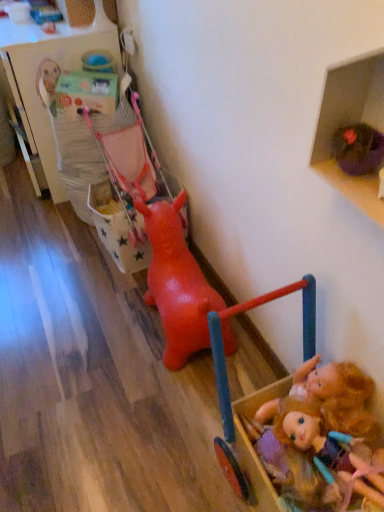
Where is `wooden toy box at upper left, the second shelf in the right-to-left sequence`? wooden toy box at upper left, the second shelf in the right-to-left sequence is located at coordinates (47, 78).

Locate an element on the screen. rubber pink baby carriage at center-left is located at coordinates (128, 190).

What do you see at coordinates (292, 413) in the screenshot? I see `wooden dollhouse at lower right, arranged as the second toy when viewed from the back` at bounding box center [292, 413].

Where is `wooden toy box at upper left, the second shelf in the right-to-left sequence`? wooden toy box at upper left, the second shelf in the right-to-left sequence is located at coordinates (47, 78).

Is wooden toy box at upper left, the second shelf in the right-to-left sequence, located outside purple fabric basket at upper right, which is the second shelf in left-to-right order?

Yes.

Which object is further away from the camera, wooden toy box at upper left, the first shelf when ordered from left to right, or purple fabric basket at upper right, acting as the 1th shelf starting from the front?

Positioned behind is wooden toy box at upper left, the first shelf when ordered from left to right.

Is wooden toy box at upper left, the second shelf in the right-to-left sequence, smaller than purple fabric basket at upper right, which is the second shelf in left-to-right order?

Incorrect, wooden toy box at upper left, the second shelf in the right-to-left sequence, is not smaller in size than purple fabric basket at upper right, which is the second shelf in left-to-right order.

Are wooden toy box at upper left, acting as the first shelf starting from the top, and purple fabric basket at upper right, which is the first shelf from right to left, making contact?

No.

Is wooden toy box at upper left, the first shelf when ordered from left to right, bigger or smaller than rubber dog at center, which appears as the 1th toy when viewed from the back?

wooden toy box at upper left, the first shelf when ordered from left to right, is bigger than rubber dog at center, which appears as the 1th toy when viewed from the back.

Is wooden toy box at upper left, the first shelf when ordered from left to right, further to the viewer compared to rubber dog at center, which appears as the 1th toy when viewed from the back?

Yes, it is behind rubber dog at center, which appears as the 1th toy when viewed from the back.

From the image's perspective, count 1st toys downward from the wooden toy box at upper left, arranged as the 2th shelf when ordered from the bottom, and point to it. Please provide its 2D coordinates.

[(176, 283)]

Considering the relative sizes of wooden toy box at upper left, placed as the 1th shelf when sorted from back to front, and rubber dog at center, arranged as the 2th toy when viewed from the front, in the image provided, is wooden toy box at upper left, placed as the 1th shelf when sorted from back to front, thinner than rubber dog at center, arranged as the 2th toy when viewed from the front,?

In fact, wooden toy box at upper left, placed as the 1th shelf when sorted from back to front, might be wider than rubber dog at center, arranged as the 2th toy when viewed from the front.

Is rubber dog at center, arranged as the 2th toy when viewed from the front, facing away from rubber pink baby carriage at center-left?

No, rubber dog at center, arranged as the 2th toy when viewed from the front, is not facing away from rubber pink baby carriage at center-left.

How many degrees apart are the facing directions of rubber dog at center, arranged as the 2th toy when viewed from the front, and rubber pink baby carriage at center-left?

The angle between the facing direction of rubber dog at center, arranged as the 2th toy when viewed from the front, and the facing direction of rubber pink baby carriage at center-left is 0.000479 degrees.

Is rubber dog at center, arranged as the 2th toy when viewed from the front, bigger than rubber pink baby carriage at center-left?

Yes.

Is point (147, 302) closer to camera compared to point (129, 214)?

Yes, point (147, 302) is closer to viewer.

From the image's perspective, is purple fabric basket at upper right, placed as the 2th shelf when sorted from top to bottom, located above wooden dollhouse at lower right, arranged as the second toy when viewed from the back?

Yes, from the image's perspective, purple fabric basket at upper right, placed as the 2th shelf when sorted from top to bottom, is over wooden dollhouse at lower right, arranged as the second toy when viewed from the back.

Find the location of `shelf that is the 1st object located above the wooden dollhouse at lower right, arranged as the second toy when viewed from the back (from the image's perspective)`. shelf that is the 1st object located above the wooden dollhouse at lower right, arranged as the second toy when viewed from the back (from the image's perspective) is located at coordinates (351, 123).

Between purple fabric basket at upper right, which is the first shelf from right to left, and wooden dollhouse at lower right, which is the 1th toy from front to back, which one has smaller width?

With smaller width is purple fabric basket at upper right, which is the first shelf from right to left.

Could you tell me if purple fabric basket at upper right, the first shelf from the bottom, is facing wooden dollhouse at lower right, which is the 1th toy from front to back?

No, purple fabric basket at upper right, the first shelf from the bottom, is not turned towards wooden dollhouse at lower right, which is the 1th toy from front to back.

Which of these two, plush blonde doll at lower right or wooden dollhouse at lower right, arranged as the second toy when viewed from the back, is smaller?

plush blonde doll at lower right is smaller.

How many degrees apart are the facing directions of plush blonde doll at lower right and wooden dollhouse at lower right, which is the 1th toy from front to back?

There is a 84.2-degree angle between the facing directions of plush blonde doll at lower right and wooden dollhouse at lower right, which is the 1th toy from front to back.

Looking at this image, is plush blonde doll at lower right behind wooden dollhouse at lower right, which is the 1th toy from front to back?

Yes, it is.

Is plush blonde doll at lower right not inside wooden dollhouse at lower right, arranged as the second toy when viewed from the back?

No.

Between rubber dog at center, arranged as the 2th toy when viewed from the front, and wooden dollhouse at lower right, arranged as the second toy when viewed from the back, which one appears on the left side from the viewer's perspective?

rubber dog at center, arranged as the 2th toy when viewed from the front, is more to the left.

From a real-world perspective, is rubber dog at center, arranged as the 2th toy when viewed from the front, beneath wooden dollhouse at lower right, arranged as the second toy when viewed from the back?

Yes, from a real-world perspective, rubber dog at center, arranged as the 2th toy when viewed from the front, is below wooden dollhouse at lower right, arranged as the second toy when viewed from the back.

From the picture: Is rubber dog at center, arranged as the 2th toy when viewed from the front, aimed at wooden dollhouse at lower right, arranged as the second toy when viewed from the back?

No.

Is rubber dog at center, arranged as the 2th toy when viewed from the front, behind wooden dollhouse at lower right, arranged as the second toy when viewed from the back?

Yes, it is behind wooden dollhouse at lower right, arranged as the second toy when viewed from the back.

Does point (329, 423) appear closer or farther from the camera than point (50, 146)?

Clearly, point (329, 423) is closer to the camera than point (50, 146).

Looking at this image, does plush blonde doll at lower right lie in front of wooden toy box at upper left, the second shelf viewed from the front?

That is True.

Which of these two, plush blonde doll at lower right or wooden toy box at upper left, arranged as the 2th shelf when ordered from the bottom, is bigger?

Bigger between the two is wooden toy box at upper left, arranged as the 2th shelf when ordered from the bottom.

How many degrees apart are the facing directions of plush blonde doll at lower right and wooden toy box at upper left, the second shelf in the right-to-left sequence?

The angular difference between plush blonde doll at lower right and wooden toy box at upper left, the second shelf in the right-to-left sequence, is 84.2 degrees.

Find the location of `shelf to the left of purple fabric basket at upper right, the first shelf from the bottom`. shelf to the left of purple fabric basket at upper right, the first shelf from the bottom is located at coordinates (47, 78).

Where is `the 2nd toy located beneath the wooden toy box at upper left, acting as the first shelf starting from the top (from a real-world perspective)`? The image size is (384, 512). the 2nd toy located beneath the wooden toy box at upper left, acting as the first shelf starting from the top (from a real-world perspective) is located at coordinates (176, 283).

Looking at the image, which one is located further to wooden toy box at upper left, the second shelf viewed from the front, plush blonde doll at lower right or rubber dog at center, which appears as the 1th toy when viewed from the back?

The object further to wooden toy box at upper left, the second shelf viewed from the front, is plush blonde doll at lower right.

Looking at the image, which one is located further to wooden toy box at upper left, arranged as the 2th shelf when ordered from the bottom, plush blonde doll at lower right or wooden dollhouse at lower right, arranged as the second toy when viewed from the back?

plush blonde doll at lower right lies further to wooden toy box at upper left, arranged as the 2th shelf when ordered from the bottom, than the other object.

Estimate the real-world distances between objects in this image. Which object is closer to wooden toy box at upper left, the second shelf in the right-to-left sequence, purple fabric basket at upper right, placed as the 2th shelf when sorted from top to bottom, or wooden dollhouse at lower right, which is the 1th toy from front to back?

The object closer to wooden toy box at upper left, the second shelf in the right-to-left sequence, is wooden dollhouse at lower right, which is the 1th toy from front to back.

Based on their spatial positions, is rubber pink baby carriage at center-left or purple fabric basket at upper right, the second shelf positioned from the back, further from plush blonde doll at lower right?

The object further to plush blonde doll at lower right is rubber pink baby carriage at center-left.

Considering their positions, is purple fabric basket at upper right, placed as the 2th shelf when sorted from top to bottom, positioned further to wooden dollhouse at lower right, which is the 1th toy from front to back, than plush blonde doll at lower right?

purple fabric basket at upper right, placed as the 2th shelf when sorted from top to bottom, lies further to wooden dollhouse at lower right, which is the 1th toy from front to back, than the other object.

Which object lies further to the anchor point plush blonde doll at lower right, wooden toy box at upper left, acting as the first shelf starting from the top, or purple fabric basket at upper right, which is the first shelf from right to left?

wooden toy box at upper left, acting as the first shelf starting from the top, lies further to plush blonde doll at lower right than the other object.

Considering their positions, is wooden toy box at upper left, the second shelf in the right-to-left sequence, positioned closer to rubber pink baby carriage at center-left than purple fabric basket at upper right, placed as the 2th shelf when sorted from top to bottom?

wooden toy box at upper left, the second shelf in the right-to-left sequence.

When comparing their distances from rubber dog at center, arranged as the 2th toy when viewed from the front, does purple fabric basket at upper right, which is the first shelf from right to left, or wooden toy box at upper left, the second shelf viewed from the front, seem closer?

purple fabric basket at upper right, which is the first shelf from right to left, lies closer to rubber dog at center, arranged as the 2th toy when viewed from the front, than the other object.

This screenshot has height=512, width=384. I want to click on toy between purple fabric basket at upper right, acting as the 1th shelf starting from the front, and rubber dog at center, which appears as the 1th toy when viewed from the back, from front to back, so click(292, 413).

Find the location of a particular element. This screenshot has height=512, width=384. baby carriage between wooden toy box at upper left, acting as the first shelf starting from the top, and wooden dollhouse at lower right, which is the 1th toy from front to back, from top to bottom is located at coordinates (128, 190).

In order to click on toy between plush blonde doll at lower right and rubber pink baby carriage at center-left along the z-axis in this screenshot , I will do `click(176, 283)`.

The height and width of the screenshot is (512, 384). I want to click on toy between wooden dollhouse at lower right, arranged as the second toy when viewed from the back, and rubber pink baby carriage at center-left, along the z-axis, so click(176, 283).